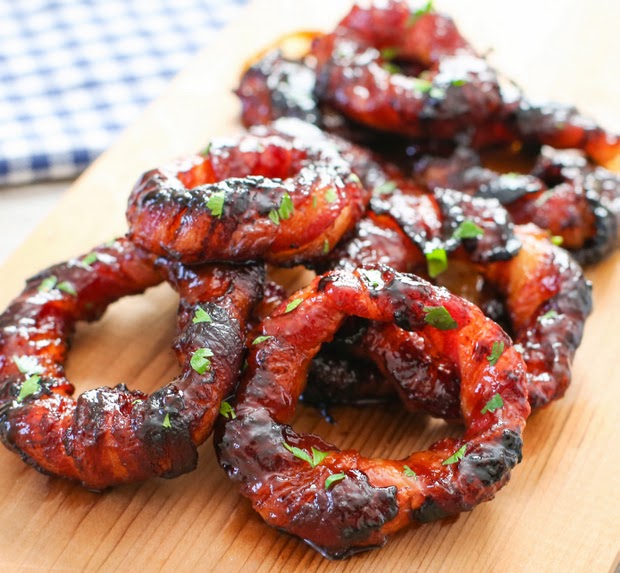
The image size is (620, 573). What are the coordinates of `blue and white checked folded tablecloth` in the screenshot? It's located at (38, 62).